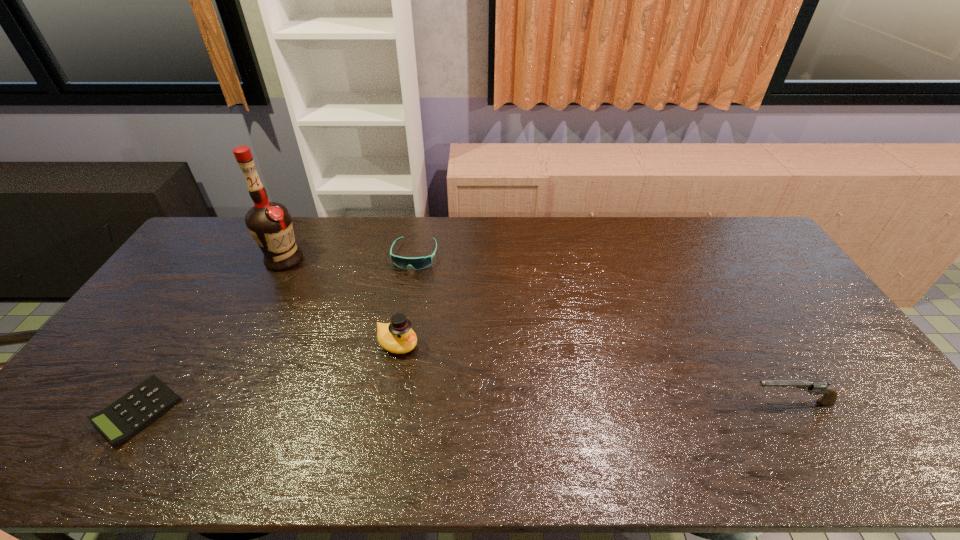
I want to click on the leftmost object, so click(124, 418).

This screenshot has height=540, width=960. What are the coordinates of `calculator` in the screenshot? It's located at (124, 418).

Find the location of a particular element. gun is located at coordinates (829, 396).

The width and height of the screenshot is (960, 540). I want to click on the rightmost object, so click(829, 396).

Where is `the fourth shortest object`? Image resolution: width=960 pixels, height=540 pixels. the fourth shortest object is located at coordinates (397, 337).

Identify the location of duck. (397, 337).

In order to click on the fourth object from right to left in this screenshot , I will do `click(270, 224)`.

Image resolution: width=960 pixels, height=540 pixels. Identify the location of the tallest object. (270, 224).

Where is `sunglasses`? sunglasses is located at coordinates (417, 263).

At what (x,y) coordinates should I click in order to perform the action: click on vacant point located on the right of the shortest object. Please return your answer as a coordinate pair (x, y). Looking at the image, I should click on (332, 410).